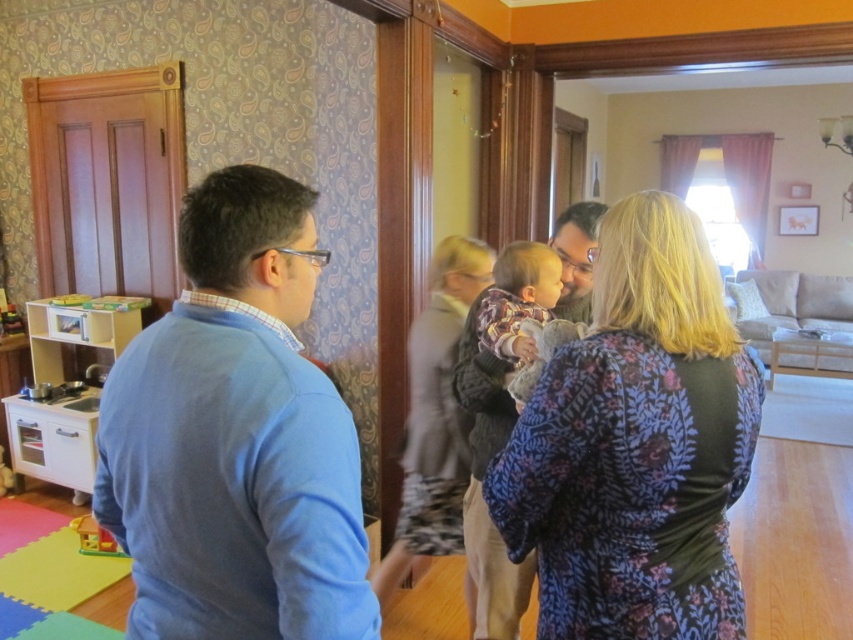
You are organizing a small event and need to place a decorative item next to the blue cotton sweater at left. Considering the space available, will the plastic yellow house at lower left fit next to it without overlapping?

The blue cotton sweater at left is wider than the plastic yellow house at lower left, so there should be enough space to place the decorative item next to the blue cotton sweater at left without overlapping.

You are standing in the living room and see the blue cotton sweater at left and the floral fabric dress at center. Which one is shorter in height?

The blue cotton sweater at left is shorter in height compared to the floral fabric dress at center.

You are standing in the living room and want to place a small plant between the floral fabric dress at center and the plastic yellow house at lower left. Which object should the plant be closer to if it needs to be placed closer to the taller object?

The floral fabric dress at center is taller than the plastic yellow house at lower left, so the plant should be placed closer to the floral fabric dress at center.